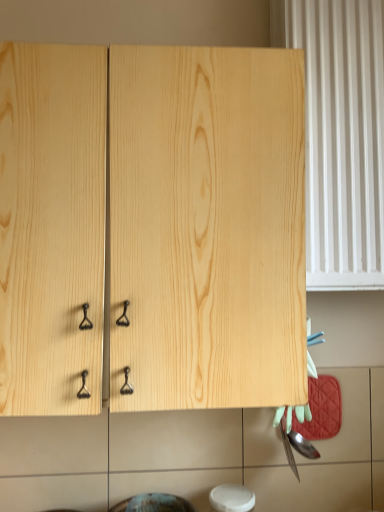
Question: From the image's perspective, does natural wood cabinet at center appear higher than white plastic radiator at right?

Choices:
 (A) no
 (B) yes

Answer: (A)

Question: Can you confirm if natural wood cabinet at center is bigger than white plastic radiator at right?

Choices:
 (A) no
 (B) yes

Answer: (B)

Question: Is natural wood cabinet at center turned away from white plastic radiator at right?

Choices:
 (A) yes
 (B) no

Answer: (B)

Question: From the image's perspective, is natural wood cabinet at center located beneath white plastic radiator at right?

Choices:
 (A) yes
 (B) no

Answer: (A)

Question: Is natural wood cabinet at center at the right side of white plastic radiator at right?

Choices:
 (A) no
 (B) yes

Answer: (A)

Question: Is natural wood cabinet at center thinner than white plastic radiator at right?

Choices:
 (A) yes
 (B) no

Answer: (B)

Question: From the image's perspective, does white plastic radiator at right appear higher than natural wood cabinet at center?

Choices:
 (A) yes
 (B) no

Answer: (A)

Question: Is white plastic radiator at right closer to camera compared to natural wood cabinet at center?

Choices:
 (A) yes
 (B) no

Answer: (B)

Question: Can you confirm if white plastic radiator at right is taller than natural wood cabinet at center?

Choices:
 (A) no
 (B) yes

Answer: (B)

Question: From the image's perspective, is white plastic radiator at right below natural wood cabinet at center?

Choices:
 (A) no
 (B) yes

Answer: (A)

Question: Can you confirm if white plastic radiator at right is thinner than natural wood cabinet at center?

Choices:
 (A) no
 (B) yes

Answer: (B)

Question: Can you confirm if white plastic radiator at right is smaller than natural wood cabinet at center?

Choices:
 (A) yes
 (B) no

Answer: (A)

Question: Is point (243, 320) closer or farther from the camera than point (337, 82)?

Choices:
 (A) farther
 (B) closer

Answer: (B)